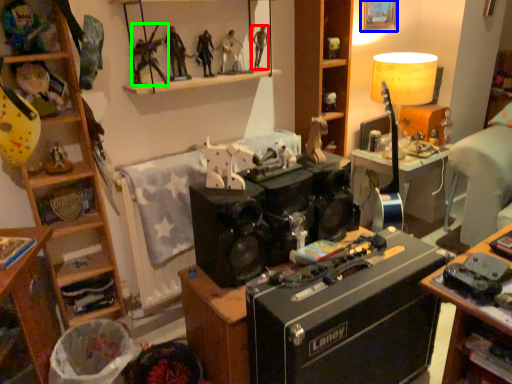
Question: Which object is the closest to the person (highlighted by a red box)? Choose among these: picture frame (highlighted by a blue box) or person (highlighted by a green box).

Choices:
 (A) picture frame
 (B) person

Answer: (B)